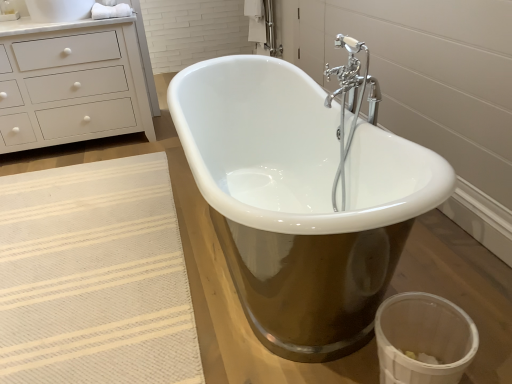
At what (x,y) coordinates should I click in order to perform the action: click on free spot in front of white matte chest of drawers at upper left. Please return your answer as a coordinate pair (x, y). Image resolution: width=512 pixels, height=384 pixels. Looking at the image, I should click on (74, 185).